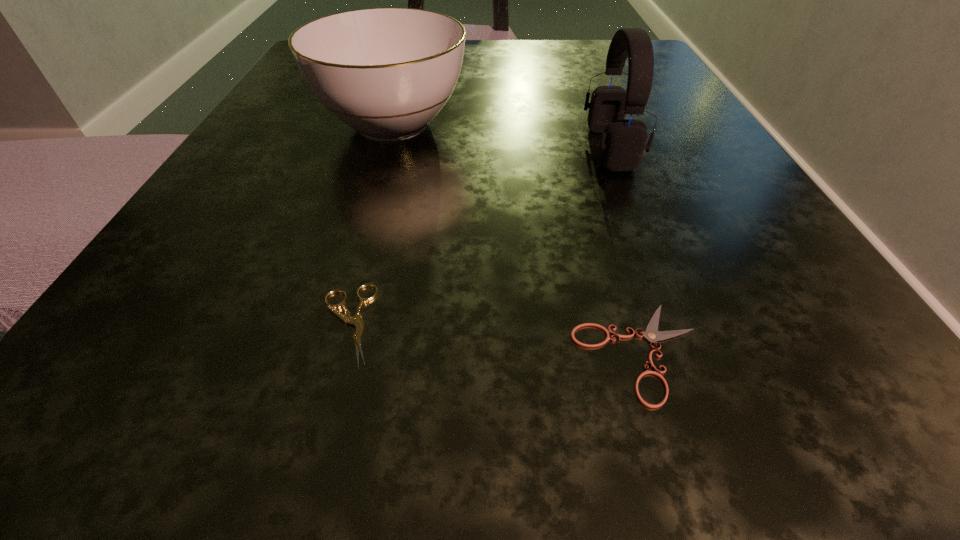
This screenshot has height=540, width=960. Find the location of `headset`. headset is located at coordinates (623, 142).

At what (x,y) coordinates should I click in order to perform the action: click on chinaware. Please return your answer as a coordinate pair (x, y). Looking at the image, I should click on (386, 73).

Image resolution: width=960 pixels, height=540 pixels. I want to click on the taller shears, so click(x=357, y=321).

Locate an element on the screen. The height and width of the screenshot is (540, 960). the third tallest object is located at coordinates (357, 321).

Locate an element on the screen. the right shears is located at coordinates (651, 334).

Where is `the shorter shears`? The height and width of the screenshot is (540, 960). the shorter shears is located at coordinates (651, 334).

Locate an element on the screen. The width and height of the screenshot is (960, 540). free space located on the headband of the headset is located at coordinates (468, 148).

Locate an element on the screen. The width and height of the screenshot is (960, 540). vacant area located 0.200m on the headband of the headset is located at coordinates (438, 148).

Locate an element on the screen. This screenshot has width=960, height=540. free location located on the headband of the headset is located at coordinates (356, 148).

I want to click on free space located 0.300m on the front of the third shortest object, so [322, 368].